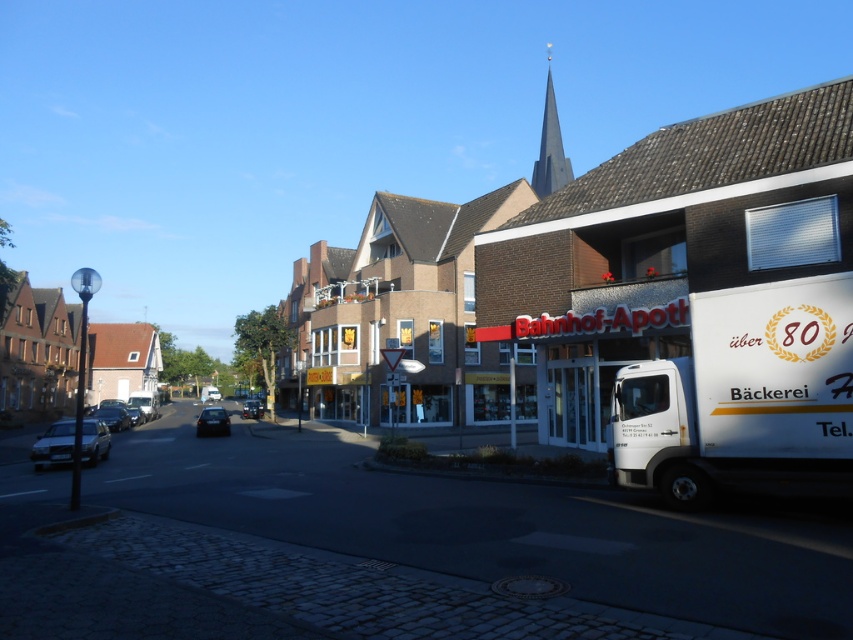
What is the color of the building located at the point with coordinates (65, 355)?

The point at coordinates (65, 355) indicates the brown brick building at left.

Looking at this image, you are a photographer standing in the middle of the street. You want to capture a photo that includes both the dark gray stone spire at upper center and the shiny black car at lower left. However, you notice that the white delivery truck parked in front of the bakery might block your view. Based on their positions, is there a chance that the white delivery truck is between you and either of these objects? Explain your reasoning.

The white delivery truck is parked in front of the bakery on the right side of the image. The dark gray stone spire at upper center is located above the center of the image, likely behind or above the truck, while the shiny black car at lower left is positioned at the lower left corner, which is away from the truck. Therefore, the truck might block the view of the dark gray stone spire at upper center but not the shiny black car at lower left.

What is located at the coordinates point (743, 396)?

The white matte truck at right is located at point (743, 396).